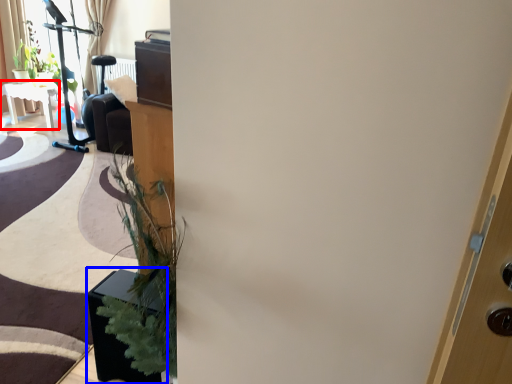
Question: Which object is closer to the camera taking this photo, table (highlighted by a red box) or furniture (highlighted by a blue box)?

Choices:
 (A) table
 (B) furniture

Answer: (B)